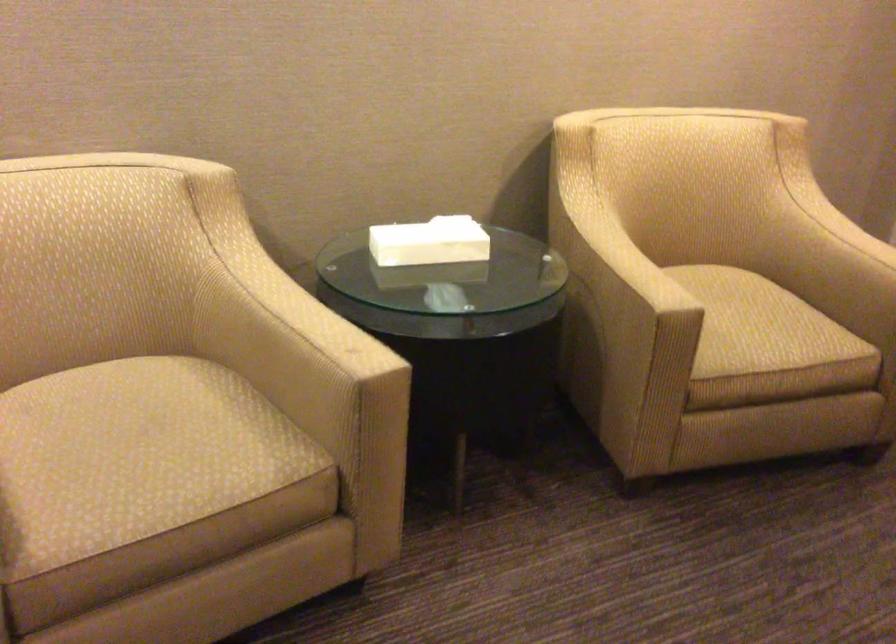
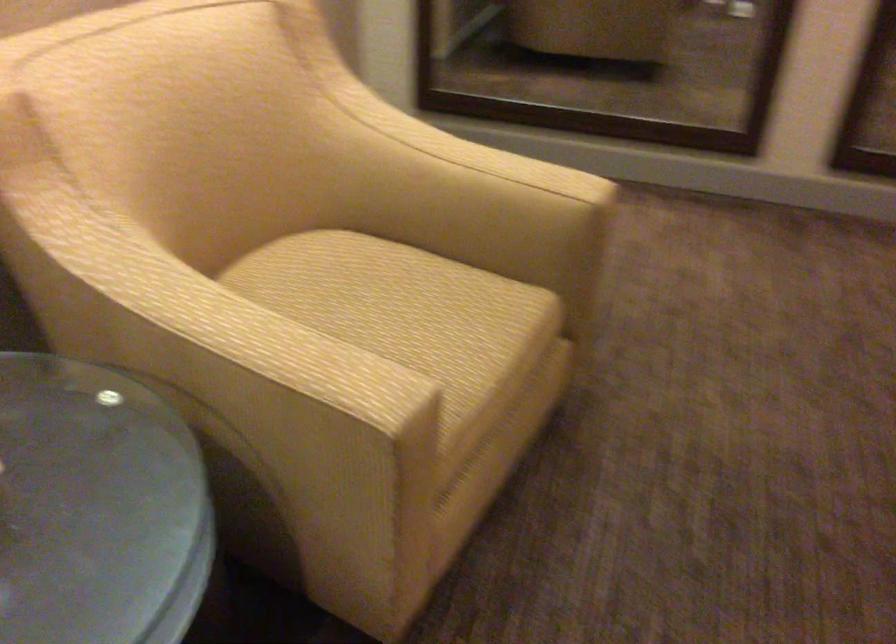
The point at (x=754, y=310) is marked in the first image. Where is the corresponding point in the second image?

(403, 310)